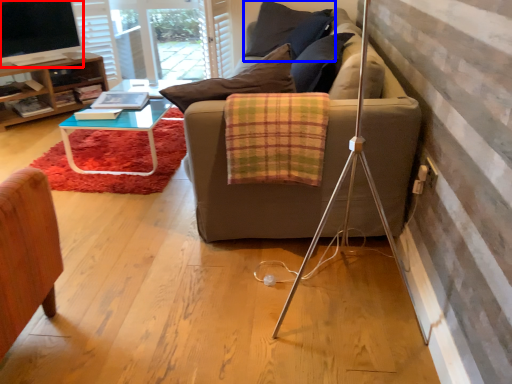
Question: Which object appears farthest to the camera in this image, television (highlighted by a red box) or pillow (highlighted by a blue box)?

Choices:
 (A) television
 (B) pillow

Answer: (B)